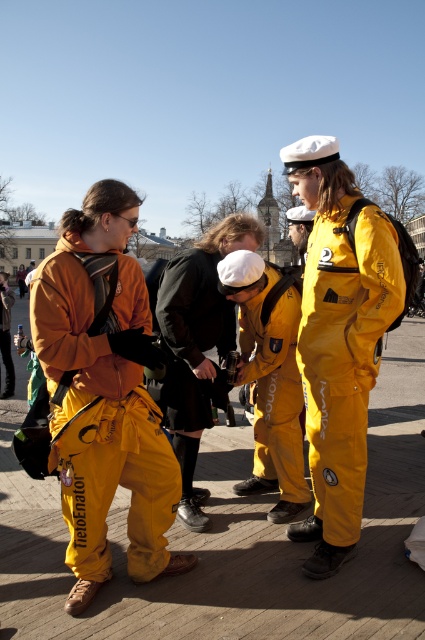
Question: Which object is positioned farthest from the yellow fabric jacket at left?

Choices:
 (A) yellow waterproof suit at center
 (B) yellow matte uniform at center
 (C) matte orange jumpsuit at center

Answer: (A)

Question: Estimate the real-world distances between objects in this image. Which object is closer to the matte orange jumpsuit at center?

Choices:
 (A) yellow waterproof suit at center
 (B) yellow fabric jacket at left

Answer: (A)

Question: Among these points, which one is farthest from the camera?

Choices:
 (A) (3, 326)
 (B) (374, 308)

Answer: (A)

Question: Can you confirm if yellow matte uniform at center is thinner than yellow fabric jacket at left?

Choices:
 (A) yes
 (B) no

Answer: (A)

Question: Is yellow waterproof suit at center further to camera compared to yellow matte uniform at center?

Choices:
 (A) no
 (B) yes

Answer: (A)

Question: Is yellow waterproof suit at center to the left of yellow fabric jacket at left from the viewer's perspective?

Choices:
 (A) no
 (B) yes

Answer: (A)